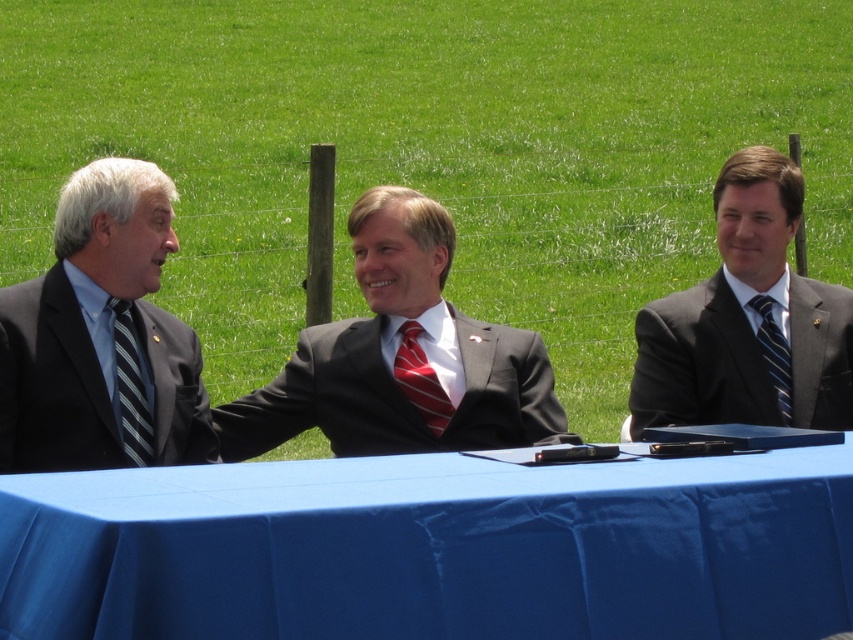
Question: Is blue fabric table at center in front of striped silk tie at left?

Choices:
 (A) yes
 (B) no

Answer: (A)

Question: Considering the relative positions of matte black suit at center and red striped tie at center in the image provided, where is matte black suit at center located with respect to red striped tie at center?

Choices:
 (A) below
 (B) above

Answer: (B)

Question: Does striped silk tie at left appear under blue striped tie at right?

Choices:
 (A) no
 (B) yes

Answer: (B)

Question: Estimate the real-world distances between objects in this image. Which object is closer to the blue fabric table at center?

Choices:
 (A) matte gray suit at right
 (B) striped silk tie at left
 (C) blue striped tie at right
 (D) matte black suit at center

Answer: (B)

Question: Which point is farther to the camera?

Choices:
 (A) (229, 417)
 (B) (51, 321)

Answer: (A)

Question: Among these points, which one is farthest from the camera?

Choices:
 (A) (758, 300)
 (B) (22, 320)
 (C) (407, 342)

Answer: (A)